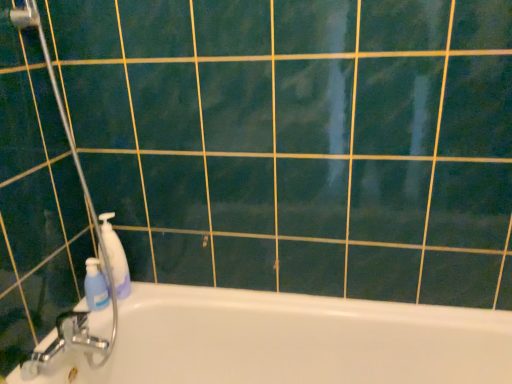
Where is `blue plastic bottle at left, marked as the 1th cleaning product in a left-to-right arrangement`? This screenshot has height=384, width=512. blue plastic bottle at left, marked as the 1th cleaning product in a left-to-right arrangement is located at coordinates (95, 286).

In order to click on blue plastic pump bottle at left, which is the 1th cleaning product from right to left in this screenshot , I will do `click(115, 257)`.

What is the approximate width of white glossy bathtub at lower left?

The width of white glossy bathtub at lower left is 46.62 centimeters.

Image resolution: width=512 pixels, height=384 pixels. In order to click on blue plastic bottle at left, marked as the 1th cleaning product in a left-to-right arrangement in this screenshot , I will do `click(95, 286)`.

Considering the sizes of blue plastic bottle at left, marked as the 1th cleaning product in a left-to-right arrangement, and transparent plastic shower door at left in the image, is blue plastic bottle at left, marked as the 1th cleaning product in a left-to-right arrangement, wider or thinner than transparent plastic shower door at left?

In the image, blue plastic bottle at left, marked as the 1th cleaning product in a left-to-right arrangement, appears to be more narrow than transparent plastic shower door at left.

Considering the sizes of blue plastic bottle at left, arranged as the 2th cleaning product when viewed from the right, and transparent plastic shower door at left in the image, is blue plastic bottle at left, arranged as the 2th cleaning product when viewed from the right, taller or shorter than transparent plastic shower door at left?

Considering their sizes, blue plastic bottle at left, arranged as the 2th cleaning product when viewed from the right, has less height than transparent plastic shower door at left.

Which object is further away from the camera, blue plastic bottle at left, arranged as the 2th cleaning product when viewed from the right, or transparent plastic shower door at left?

blue plastic bottle at left, arranged as the 2th cleaning product when viewed from the right, is behind.

Is blue plastic bottle at left, marked as the 1th cleaning product in a left-to-right arrangement, in contact with transparent plastic shower door at left?

blue plastic bottle at left, marked as the 1th cleaning product in a left-to-right arrangement, and transparent plastic shower door at left are clearly separated.

Is blue plastic pump bottle at left, which ranks as the 2th cleaning product in left-to-right order, positioned far away from transparent plastic shower door at left?

blue plastic pump bottle at left, which ranks as the 2th cleaning product in left-to-right order, is actually quite close to transparent plastic shower door at left.

From a real-world perspective, which is physically above, blue plastic pump bottle at left, which ranks as the 2th cleaning product in left-to-right order, or transparent plastic shower door at left?

transparent plastic shower door at left is physically above.

How far apart are blue plastic pump bottle at left, which is the 1th cleaning product from right to left, and transparent plastic shower door at left?

4.62 inches.

Considering their positions, is blue plastic pump bottle at left, which is the 1th cleaning product from right to left, located in front of or behind transparent plastic shower door at left?

Visually, blue plastic pump bottle at left, which is the 1th cleaning product from right to left, is located behind transparent plastic shower door at left.

Is transparent plastic shower door at left at the right side of white glossy bathtub at lower left?

No.

Who is smaller, transparent plastic shower door at left or white glossy bathtub at lower left?

Smaller between the two is transparent plastic shower door at left.

From a real-world perspective, relative to white glossy bathtub at lower left, is transparent plastic shower door at left vertically above or below?

From a real-world perspective, transparent plastic shower door at left is physically above white glossy bathtub at lower left.

From a real-world perspective, is blue plastic pump bottle at left, which is the 1th cleaning product from right to left, positioned above or below white glossy bathtub at lower left?

blue plastic pump bottle at left, which is the 1th cleaning product from right to left, is situated higher than white glossy bathtub at lower left in the real world.

Looking at this image, considering the sizes of objects blue plastic pump bottle at left, which is the 1th cleaning product from right to left, and white glossy bathtub at lower left in the image provided, who is taller, blue plastic pump bottle at left, which is the 1th cleaning product from right to left, or white glossy bathtub at lower left?

With more height is white glossy bathtub at lower left.

Considering the positions of objects blue plastic pump bottle at left, which is the 1th cleaning product from right to left, and white glossy bathtub at lower left in the image provided, who is more to the right, blue plastic pump bottle at left, which is the 1th cleaning product from right to left, or white glossy bathtub at lower left?

Positioned to the right is white glossy bathtub at lower left.

How far apart are blue plastic pump bottle at left, which is the 1th cleaning product from right to left, and white glossy bathtub at lower left?

blue plastic pump bottle at left, which is the 1th cleaning product from right to left, is 42.58 centimeters from white glossy bathtub at lower left.

How many degrees apart are the facing directions of blue plastic bottle at left, arranged as the 2th cleaning product when viewed from the right, and white glossy bathtub at lower left?

The angle between the facing direction of blue plastic bottle at left, arranged as the 2th cleaning product when viewed from the right, and the facing direction of white glossy bathtub at lower left is 92.4 degrees.

Based on the photo, does blue plastic bottle at left, arranged as the 2th cleaning product when viewed from the right, have a larger size compared to white glossy bathtub at lower left?

No.

From the image's perspective, who appears lower, blue plastic bottle at left, marked as the 1th cleaning product in a left-to-right arrangement, or white glossy bathtub at lower left?

white glossy bathtub at lower left, from the image's perspective.

Between blue plastic bottle at left, marked as the 1th cleaning product in a left-to-right arrangement, and white glossy bathtub at lower left, which one has smaller width?

blue plastic bottle at left, marked as the 1th cleaning product in a left-to-right arrangement, is thinner.

Is transparent plastic shower door at left wider than blue plastic pump bottle at left, which is the 1th cleaning product from right to left?

Correct, the width of transparent plastic shower door at left exceeds that of blue plastic pump bottle at left, which is the 1th cleaning product from right to left.

Considering the relative sizes of transparent plastic shower door at left and blue plastic pump bottle at left, which ranks as the 2th cleaning product in left-to-right order, in the image provided, is transparent plastic shower door at left smaller than blue plastic pump bottle at left, which ranks as the 2th cleaning product in left-to-right order,?

No.

Is transparent plastic shower door at left not near blue plastic pump bottle at left, which is the 1th cleaning product from right to left?

No, there isn't a large distance between transparent plastic shower door at left and blue plastic pump bottle at left, which is the 1th cleaning product from right to left.

There is a blue plastic pump bottle at left, which is the 1th cleaning product from right to left. Where is `shower door above it (from a real-world perspective)`? shower door above it (from a real-world perspective) is located at coordinates (95, 231).

From the image's perspective, who appears lower, white glossy bathtub at lower left or transparent plastic shower door at left?

From the image's view, white glossy bathtub at lower left is below.

From a real-world perspective, relative to transparent plastic shower door at left, is white glossy bathtub at lower left vertically above or below?

From a real-world perspective, white glossy bathtub at lower left is physically below transparent plastic shower door at left.

Can we say white glossy bathtub at lower left lies outside transparent plastic shower door at left?

white glossy bathtub at lower left lies outside transparent plastic shower door at left's area.

Is white glossy bathtub at lower left to the left or to the right of transparent plastic shower door at left in the image?

In the image, white glossy bathtub at lower left appears on the right side of transparent plastic shower door at left.

Where is `cleaning product that is the 2nd one when counting backward from the transparent plastic shower door at left`? cleaning product that is the 2nd one when counting backward from the transparent plastic shower door at left is located at coordinates (95, 286).

You are a GUI agent. You are given a task and a screenshot of the screen. Output one action in this format:
    pyautogui.click(x=<x>, y=<y>)
    Task: Click on the shower door above the blue plastic pump bottle at left, which is the 1th cleaning product from right to left (from the image's perspective)
    
    Given the screenshot: What is the action you would take?
    pyautogui.click(x=95, y=231)

From the image, which object appears to be farther from white glossy bathtub at lower left, blue plastic pump bottle at left, which ranks as the 2th cleaning product in left-to-right order, or transparent plastic shower door at left?

transparent plastic shower door at left lies further to white glossy bathtub at lower left than the other object.

Which object lies nearer to the anchor point blue plastic bottle at left, arranged as the 2th cleaning product when viewed from the right, white glossy bathtub at lower left or transparent plastic shower door at left?

transparent plastic shower door at left is positioned closer to the anchor blue plastic bottle at left, arranged as the 2th cleaning product when viewed from the right.

Considering their positions, is blue plastic bottle at left, arranged as the 2th cleaning product when viewed from the right, positioned further to white glossy bathtub at lower left than blue plastic pump bottle at left, which is the 1th cleaning product from right to left?

The object further to white glossy bathtub at lower left is blue plastic bottle at left, arranged as the 2th cleaning product when viewed from the right.

Based on the photo, estimate the real-world distances between objects in this image. Which object is further from white glossy bathtub at lower left, transparent plastic shower door at left or blue plastic pump bottle at left, which is the 1th cleaning product from right to left?

transparent plastic shower door at left is further to white glossy bathtub at lower left.

Estimate the real-world distances between objects in this image. Which object is closer to blue plastic bottle at left, arranged as the 2th cleaning product when viewed from the right, blue plastic pump bottle at left, which ranks as the 2th cleaning product in left-to-right order, or white glossy bathtub at lower left?

The object closer to blue plastic bottle at left, arranged as the 2th cleaning product when viewed from the right, is blue plastic pump bottle at left, which ranks as the 2th cleaning product in left-to-right order.

From the image, which object appears to be nearer to white glossy bathtub at lower left, blue plastic bottle at left, arranged as the 2th cleaning product when viewed from the right, or transparent plastic shower door at left?

transparent plastic shower door at left is positioned closer to the anchor white glossy bathtub at lower left.

Considering their positions, is blue plastic pump bottle at left, which ranks as the 2th cleaning product in left-to-right order, positioned closer to blue plastic bottle at left, arranged as the 2th cleaning product when viewed from the right, than transparent plastic shower door at left?

blue plastic pump bottle at left, which ranks as the 2th cleaning product in left-to-right order, lies closer to blue plastic bottle at left, arranged as the 2th cleaning product when viewed from the right, than the other object.

Which object lies further to the anchor point transparent plastic shower door at left, white glossy bathtub at lower left or blue plastic pump bottle at left, which is the 1th cleaning product from right to left?

Based on the image, white glossy bathtub at lower left appears to be further to transparent plastic shower door at left.

Image resolution: width=512 pixels, height=384 pixels. Identify the location of shower door between blue plastic bottle at left, arranged as the 2th cleaning product when viewed from the right, and white glossy bathtub at lower left, in the horizontal direction. (95, 231).

The height and width of the screenshot is (384, 512). Identify the location of cleaning product positioned between transparent plastic shower door at left and blue plastic bottle at left, marked as the 1th cleaning product in a left-to-right arrangement, from near to far. pyautogui.click(x=115, y=257).

Where is `cleaning product between blue plastic bottle at left, arranged as the 2th cleaning product when viewed from the right, and white glossy bathtub at lower left`? Image resolution: width=512 pixels, height=384 pixels. cleaning product between blue plastic bottle at left, arranged as the 2th cleaning product when viewed from the right, and white glossy bathtub at lower left is located at coordinates (115, 257).

At what (x,y) coordinates should I click in order to perform the action: click on shower door between blue plastic pump bottle at left, which is the 1th cleaning product from right to left, and white glossy bathtub at lower left, in the horizontal direction. Please return your answer as a coordinate pair (x, y). The image size is (512, 384). Looking at the image, I should click on point(95,231).